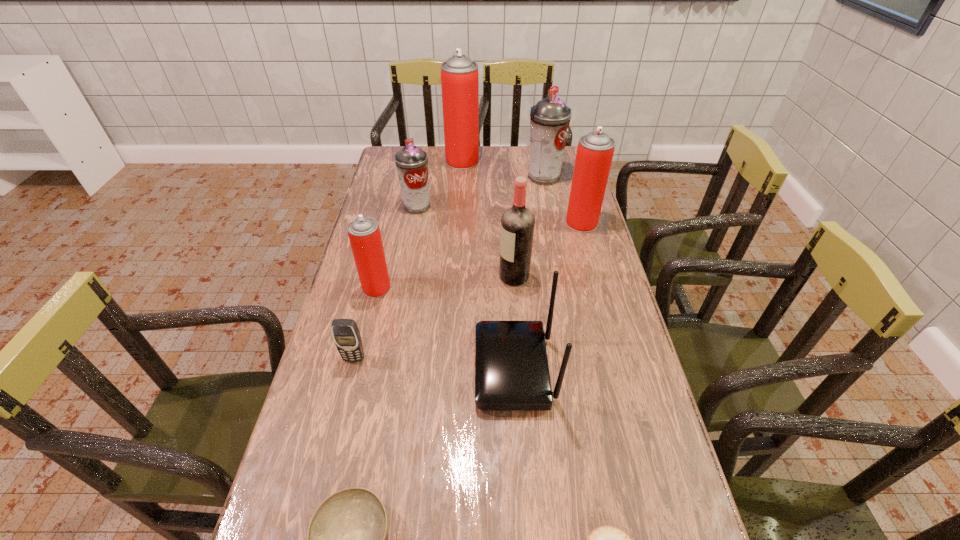
You are a GUI agent. You are given a task and a screenshot of the screen. Output one action in this format:
    pyautogui.click(x=<x>, y=<y>)
    Task: Click on the left gray aerosol can
    The image size is (960, 540).
    Given the screenshot: What is the action you would take?
    pyautogui.click(x=411, y=161)

At what (x,y) coordinates should I click in order to perform the action: click on router. Please return your answer as a coordinate pair (x, y). The height and width of the screenshot is (540, 960). Looking at the image, I should click on (511, 366).

The width and height of the screenshot is (960, 540). Find the location of `the third shortest object`. the third shortest object is located at coordinates (346, 335).

Identify the location of vacant space located 0.240m on the right of the biggest red aerosol can. The height and width of the screenshot is (540, 960). (536, 161).

Where is `vacant space located on the front of the bigger gray aerosol can`? The height and width of the screenshot is (540, 960). vacant space located on the front of the bigger gray aerosol can is located at coordinates (552, 221).

I want to click on free space located 0.110m on the left of the second biggest red aerosol can, so click(x=535, y=223).

Find the location of a particular element. free space located on the front-facing side of the liquor is located at coordinates (390, 276).

In order to click on free region located 0.210m on the front-facing side of the liquor in this screenshot , I will do `click(432, 276)`.

At what (x,y) coordinates should I click in order to perform the action: click on vacant space located 0.090m on the front-facing side of the liquor. Please return your answer as a coordinate pair (x, y). This screenshot has width=960, height=540. Looking at the image, I should click on (470, 276).

What are the coordinates of `vacant space situated 0.070m on the right of the nearest red aerosol can` in the screenshot? It's located at (414, 288).